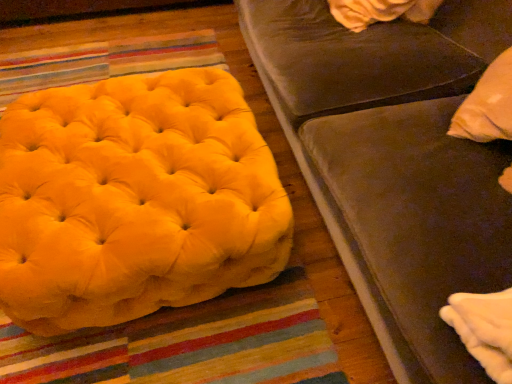
Question: Does yellow velvet ottoman at left have a greater width compared to velvet brown studio couch at upper right?

Choices:
 (A) no
 (B) yes

Answer: (A)

Question: Considering the relative sizes of yellow velvet ottoman at left and velvet brown studio couch at upper right in the image provided, is yellow velvet ottoman at left smaller than velvet brown studio couch at upper right?

Choices:
 (A) yes
 (B) no

Answer: (A)

Question: Are yellow velvet ottoman at left and velvet brown studio couch at upper right beside each other?

Choices:
 (A) yes
 (B) no

Answer: (B)

Question: Considering the relative sizes of yellow velvet ottoman at left and velvet brown studio couch at upper right in the image provided, is yellow velvet ottoman at left taller than velvet brown studio couch at upper right?

Choices:
 (A) no
 (B) yes

Answer: (A)

Question: Does yellow velvet ottoman at left have a larger size compared to velvet brown studio couch at upper right?

Choices:
 (A) yes
 (B) no

Answer: (B)

Question: Is yellow velvet ottoman at left positioned behind velvet brown studio couch at upper right?

Choices:
 (A) yes
 (B) no

Answer: (A)

Question: From a real-world perspective, does velvet brown studio couch at upper right stand above yellow velvet ottoman at left?

Choices:
 (A) no
 (B) yes

Answer: (B)

Question: From the image's perspective, is velvet brown studio couch at upper right located above yellow velvet ottoman at left?

Choices:
 (A) no
 (B) yes

Answer: (B)

Question: Does velvet brown studio couch at upper right lie in front of yellow velvet ottoman at left?

Choices:
 (A) no
 (B) yes

Answer: (B)

Question: Is yellow velvet ottoman at left completely or partially inside velvet brown studio couch at upper right?

Choices:
 (A) yes
 (B) no

Answer: (B)

Question: Is velvet brown studio couch at upper right far from yellow velvet ottoman at left?

Choices:
 (A) no
 (B) yes

Answer: (A)

Question: Is velvet brown studio couch at upper right oriented towards yellow velvet ottoman at left?

Choices:
 (A) yes
 (B) no

Answer: (A)

Question: From a real-world perspective, is yellow velvet ottoman at left positioned above or below velvet brown studio couch at upper right?

Choices:
 (A) below
 (B) above

Answer: (A)